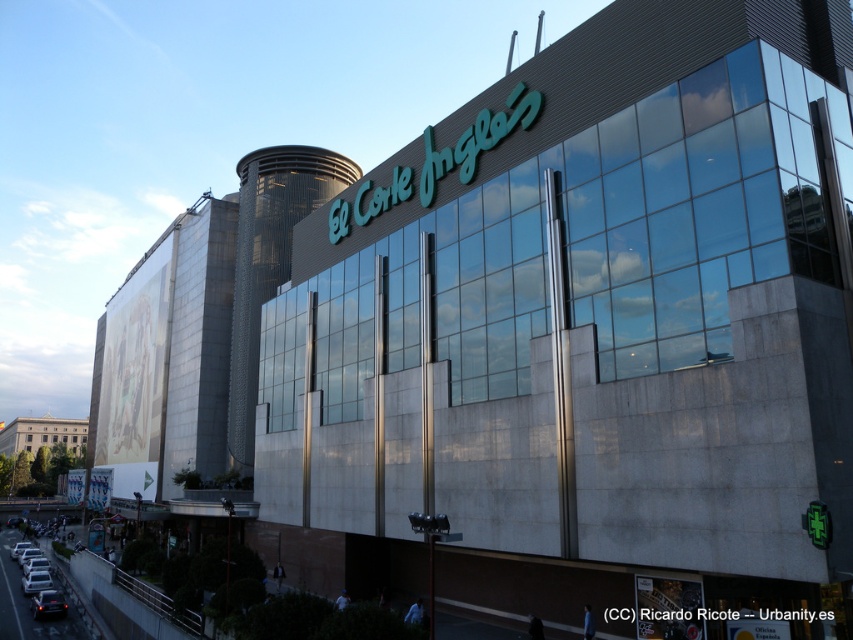
You are standing in front of the modern building with the El Corte Ingl s logo. You see two cars, a metallic silver car at lower left and a silver metallic car at lower left. Which car is more to the right?

The metallic silver car at lower left is more to the right side of the silver metallic car at lower left.

You are a photographer trying to capture both the metallic silver car at lower left and the silver metallic car at lower left in a single frame. Since both cars are positioned near each other, which car would require you to adjust your camera angle more to include its entire width in the photo?

The metallic silver car at lower left has a lesser width compared to the silver metallic car at lower left. Therefore, the silver metallic car at lower left would need a wider camera angle to capture its entire width, while the metallic silver car at lower left, being narrower, would require less adjustment.